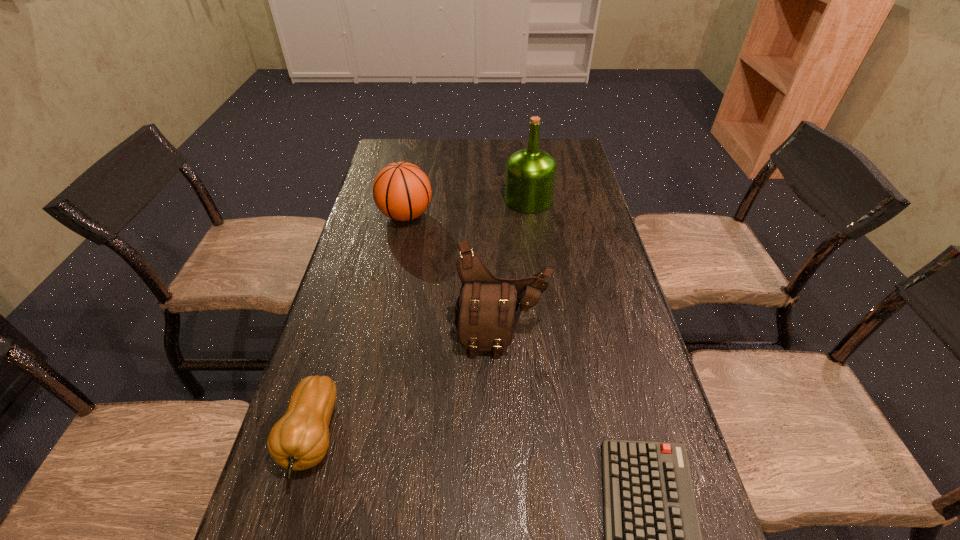
At what (x,y) coordinates should I click in order to perform the action: click on object at the right edge. Please return your answer as a coordinate pair (x, y). Image resolution: width=960 pixels, height=540 pixels. Looking at the image, I should click on (530, 176).

Identify the location of free space at the far edge. (430, 165).

Identify the location of vacant position at the left edge of the desktop. The image size is (960, 540). (379, 350).

The width and height of the screenshot is (960, 540). Find the location of `vacant space at the right edge of the desktop`. vacant space at the right edge of the desktop is located at coordinates (570, 240).

The image size is (960, 540). Identify the location of vacant position at the far left corner of the desktop. (x=424, y=138).

The image size is (960, 540). What are the coordinates of `free space between the second shortest object and the basketball` in the screenshot? It's located at (359, 326).

You are a GUI agent. You are given a task and a screenshot of the screen. Output one action in this format:
    pyautogui.click(x=<x>, y=<y>)
    Task: Click on the free space that is in between the olive oil and the second tallest object
    The width and height of the screenshot is (960, 540).
    Given the screenshot: What is the action you would take?
    pyautogui.click(x=515, y=268)

Identify the location of vacant point located between the gourd and the third nearest object. (407, 387).

Where is `empty space between the basketball and the fourth tallest object`? empty space between the basketball and the fourth tallest object is located at coordinates (359, 326).

This screenshot has width=960, height=540. What are the coordinates of `empty space between the third farthest object and the gourd` in the screenshot? It's located at (407, 387).